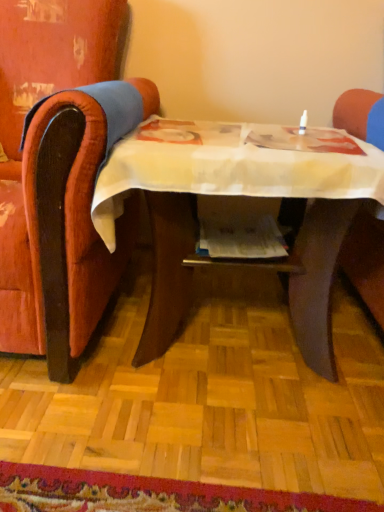
Find the location of `wooden table at center`. wooden table at center is located at coordinates (246, 198).

In order to face wooden table at center, should I rotate leftwards or rightwards?

Turn right by 7.800 degrees to look at wooden table at center.

What do you see at coordinates (23, 123) in the screenshot? I see `velvet-like red armchair at left` at bounding box center [23, 123].

Locate an element on the screen. This screenshot has height=512, width=384. printed paper magazine at center is located at coordinates (241, 238).

Is velvet-like red armchair at left at the left side of wooden table at center?

Yes, velvet-like red armchair at left is to the left of wooden table at center.

From a real-world perspective, is velvet-like red armchair at left beneath wooden table at center?

Incorrect, from a real-world perspective, velvet-like red armchair at left is higher than wooden table at center.

Based on their sizes in the image, would you say velvet-like red armchair at left is bigger or smaller than wooden table at center?

Clearly, velvet-like red armchair at left is larger in size than wooden table at center.

Between velvet-like red armchair at left and wooden table at center, which one has smaller width?

With smaller width is wooden table at center.

Is wooden table at center spatially inside printed paper magazine at center, or outside of it?

wooden table at center cannot be found inside printed paper magazine at center.

Could you tell me if wooden table at center is facing printed paper magazine at center?

Yes.

Looking at this image, is wooden table at center next to printed paper magazine at center?

wooden table at center and printed paper magazine at center are clearly separated.

Which is in front, point (293, 325) or point (237, 227)?

The point (237, 227) is closer to the camera.

Are wooden table at center and velvet-like red armchair at left making contact?

There is a gap between wooden table at center and velvet-like red armchair at left.

Is wooden table at center turned away from velvet-like red armchair at left?

No.

Which point is more distant from viewer, (121, 160) or (109, 63)?

The point (109, 63) is more distant.

From a real-world perspective, between wooden table at center and velvet-like red armchair at left, who is vertically higher?

From a 3D spatial view, velvet-like red armchair at left is above.

Is printed paper magazine at center oriented towards velvet-like red armchair at left?

No, printed paper magazine at center is not aimed at velvet-like red armchair at left.

Looking at the image, does printed paper magazine at center seem bigger or smaller compared to velvet-like red armchair at left?

printed paper magazine at center is smaller than velvet-like red armchair at left.

Does printed paper magazine at center have a lesser width compared to velvet-like red armchair at left?

Indeed, printed paper magazine at center has a lesser width compared to velvet-like red armchair at left.

Considering the relative positions of printed paper magazine at center and velvet-like red armchair at left in the image provided, is printed paper magazine at center to the left of velvet-like red armchair at left from the viewer's perspective?

In fact, printed paper magazine at center is to the right of velvet-like red armchair at left.

From a real-world perspective, is velvet-like red armchair at left under printed paper magazine at center?

No, from a real-world perspective, velvet-like red armchair at left is not below printed paper magazine at center.

Is velvet-like red armchair at left bigger or smaller than printed paper magazine at center?

In the image, velvet-like red armchair at left appears to be larger than printed paper magazine at center.

Is velvet-like red armchair at left outside of printed paper magazine at center?

Yes, velvet-like red armchair at left is located beyond the bounds of printed paper magazine at center.

Which point is more forward, (251, 225) or (294, 285)?

The point (294, 285) is more forward.

Who is smaller, printed paper magazine at center or wooden table at center?

With smaller size is printed paper magazine at center.

Measure the distance from printed paper magazine at center to wooden table at center.

printed paper magazine at center is 8.05 inches from wooden table at center.

Which object is positioned more to the right, printed paper magazine at center or wooden table at center?

Positioned to the right is wooden table at center.

You are a GUI agent. You are given a task and a screenshot of the screen. Output one action in this format:
    pyautogui.click(x=<x>, y=<y>)
    Task: Click on the chair on the left of wooden table at center
    The image size is (384, 512).
    Given the screenshot: What is the action you would take?
    pyautogui.click(x=23, y=123)

Locate an element on the screen. The image size is (384, 512). table below the printed paper magazine at center (from a real-world perspective) is located at coordinates (246, 198).

Which object lies nearer to the anchor point wooden table at center, printed paper magazine at center or velvet-like red armchair at left?

printed paper magazine at center is closer to wooden table at center.

Considering their positions, is printed paper magazine at center positioned closer to velvet-like red armchair at left than wooden table at center?

The object closer to velvet-like red armchair at left is wooden table at center.

Looking at the image, which one is located closer to wooden table at center, velvet-like red armchair at left or printed paper magazine at center?

Based on the image, printed paper magazine at center appears to be nearer to wooden table at center.

From the image, which object appears to be farther from velvet-like red armchair at left, wooden table at center or printed paper magazine at center?

The object further to velvet-like red armchair at left is printed paper magazine at center.

Consider the image. Estimate the real-world distances between objects in this image. Which object is further from printed paper magazine at center, wooden table at center or velvet-like red armchair at left?

velvet-like red armchair at left lies further to printed paper magazine at center than the other object.

When comparing their distances from printed paper magazine at center, does velvet-like red armchair at left or wooden table at center seem further?

velvet-like red armchair at left is positioned further to the anchor printed paper magazine at center.

The height and width of the screenshot is (512, 384). Find the location of `magazine situated between velvet-like red armchair at left and wooden table at center from left to right`. magazine situated between velvet-like red armchair at left and wooden table at center from left to right is located at coordinates (241, 238).